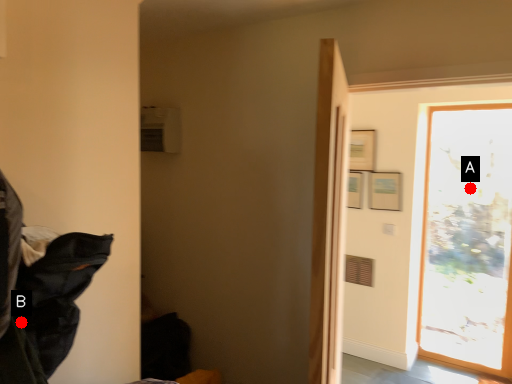
Question: Two points are circled on the image, labeled by A and B beside each circle. Among these points, which one is farthest from the camera?

Choices:
 (A) A is further
 (B) B is further

Answer: (A)